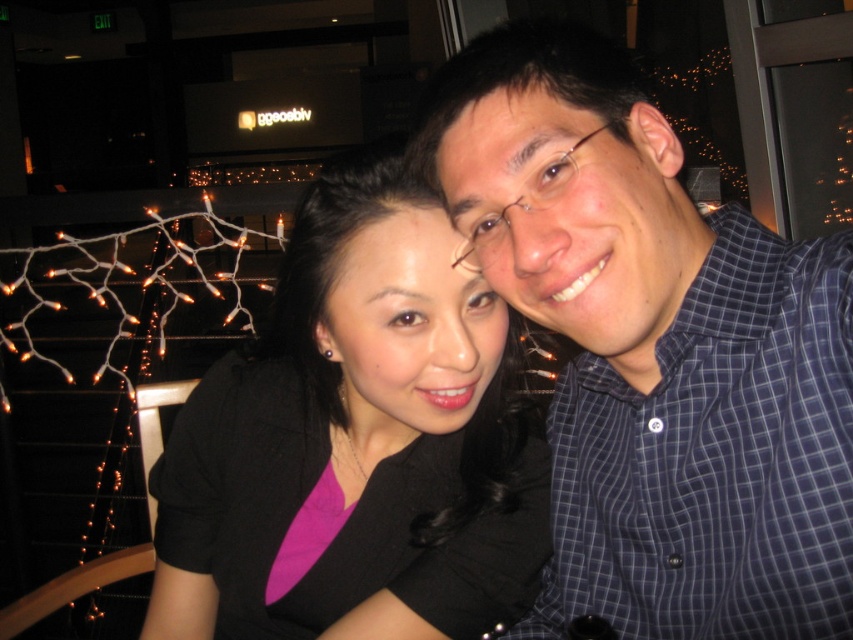
Question: Which of the following is the closest to the observer?

Choices:
 (A) black matte shirt at center
 (B) blue checkered shirt at center

Answer: (B)

Question: Can you confirm if blue checkered shirt at center is positioned above black matte shirt at center?

Choices:
 (A) no
 (B) yes

Answer: (B)

Question: Can you confirm if blue checkered shirt at center is positioned to the right of black matte shirt at center?

Choices:
 (A) yes
 (B) no

Answer: (A)

Question: Does blue checkered shirt at center have a smaller size compared to black matte shirt at center?

Choices:
 (A) yes
 (B) no

Answer: (A)